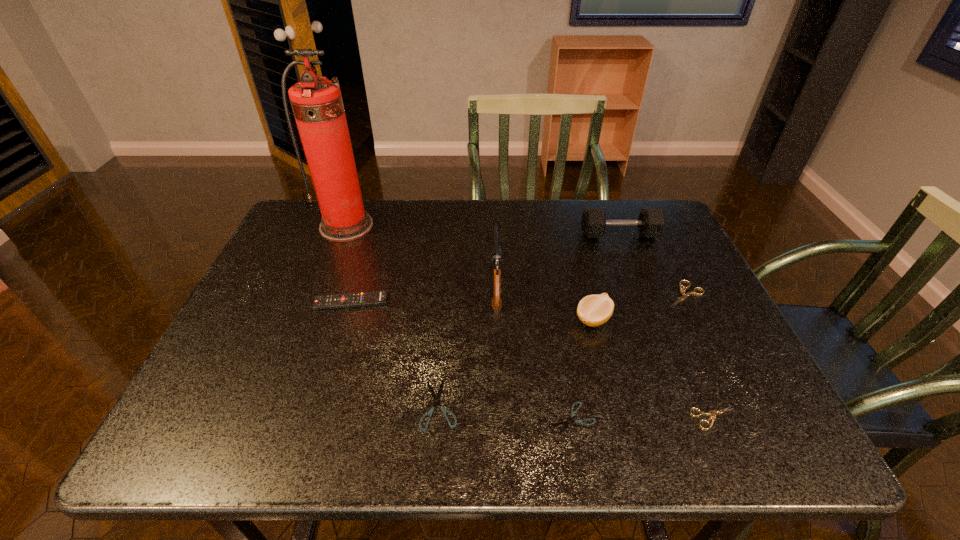
This screenshot has width=960, height=540. What are the coordinates of `the tallest object` in the screenshot? It's located at (317, 104).

At what (x,y) coordinates should I click in order to perform the action: click on the second tallest object. Please return your answer as a coordinate pair (x, y). Looking at the image, I should click on (496, 251).

Identify the location of black gun. (496, 251).

This screenshot has width=960, height=540. I want to click on dumbbell, so click(651, 222).

Identify the location of the fourth tallest object. The height and width of the screenshot is (540, 960). (593, 310).

The width and height of the screenshot is (960, 540). Identify the location of yellow lemon. (593, 310).

You are a GUI agent. You are given a task and a screenshot of the screen. Output one action in this format:
    pyautogui.click(x=<x>, y=<y>)
    Task: Click on the fifth tallest object
    
    Given the screenshot: What is the action you would take?
    pyautogui.click(x=358, y=299)

This screenshot has height=540, width=960. What are the coordinates of `the farther beige shears` in the screenshot? It's located at (682, 291).

You are a GUI agent. You are given a task and a screenshot of the screen. Output one action in this format:
    pyautogui.click(x=<x>, y=<y>)
    Task: Click on the farthest shears
    Image resolution: width=960 pixels, height=540 pixels.
    Given the screenshot: What is the action you would take?
    pyautogui.click(x=682, y=291)

At what (x,y) coordinates should I click in order to perform the action: click on the nearer beige shears. Please return your answer as a coordinate pair (x, y). Looking at the image, I should click on (713, 412).